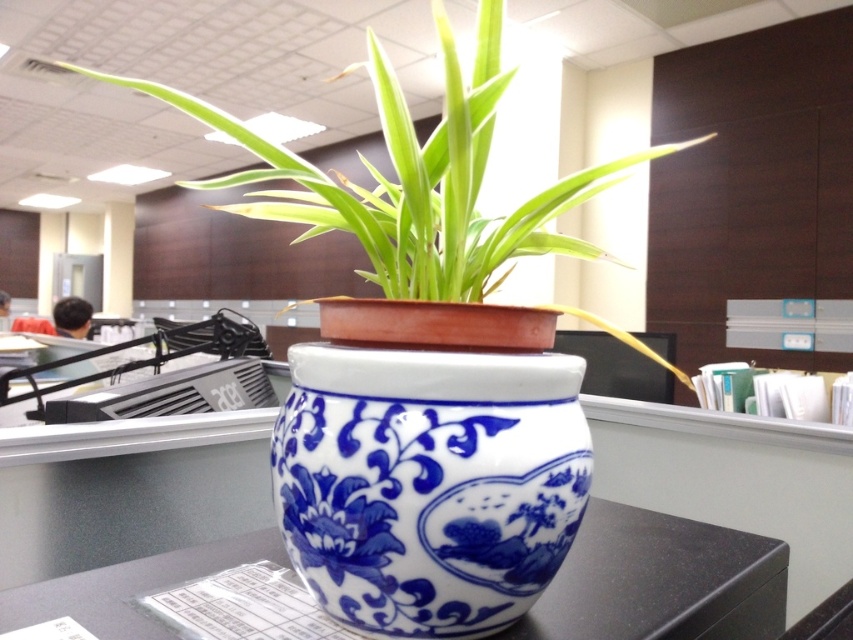
Does blue and white ceramic pot at center come behind white glossy table at center?

No.

Looking at this image, who is more forward, (297, 180) or (143, 621)?

Point (297, 180)

Is point (376, 90) closer to viewer compared to point (628, 525)?

Yes, it is.

I want to click on blue and white ceramic pot at center, so click(421, 188).

Can you confirm if blue porcelain vase at center is shorter than white glossy table at center?

In fact, blue porcelain vase at center may be taller than white glossy table at center.

Does blue porcelain vase at center have a greater height compared to white glossy table at center?

Correct, blue porcelain vase at center is much taller as white glossy table at center.

Between point (427, 584) and point (115, 602), which one is positioned in front?

Positioned in front is point (427, 584).

The image size is (853, 640). Find the location of `blue porcelain vase at center`. blue porcelain vase at center is located at coordinates (428, 483).

Based on the photo, does blue porcelain vase at center appear on the left side of blue and white ceramic pot at center?

Indeed, blue porcelain vase at center is positioned on the left side of blue and white ceramic pot at center.

Can you confirm if blue porcelain vase at center is positioned to the right of blue and white ceramic pot at center?

No, blue porcelain vase at center is not to the right of blue and white ceramic pot at center.

Who is more forward, (442, 592) or (534, 216)?

Positioned in front is point (442, 592).

At what (x,y) coordinates should I click in order to perform the action: click on blue porcelain vase at center. Please return your answer as a coordinate pair (x, y). Looking at the image, I should click on (428, 483).